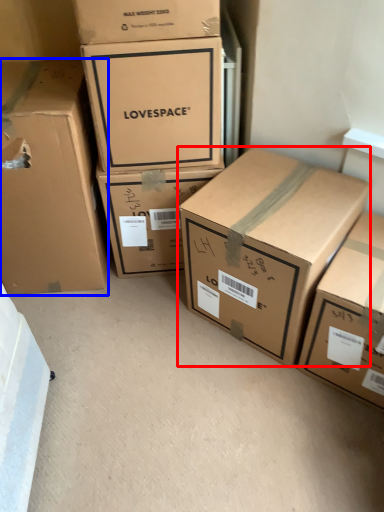
Question: Which object appears farthest to the camera in this image, box (highlighted by a red box) or box (highlighted by a blue box)?

Choices:
 (A) box
 (B) box

Answer: (B)